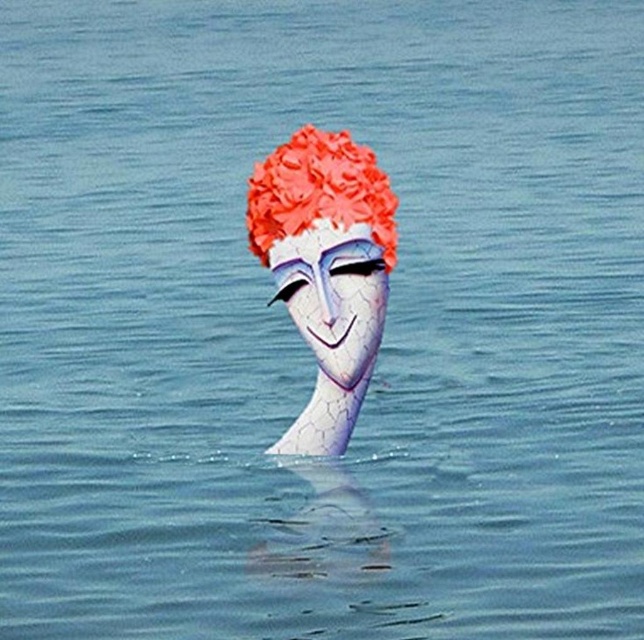
Consider the image. You are an artist analyzing a sculpture. You notice the cracked porcelain head at center and the shiny orange hair at center. Which object is taller in the sculpture?

The cracked porcelain head at center is much taller than the shiny orange hair at center.